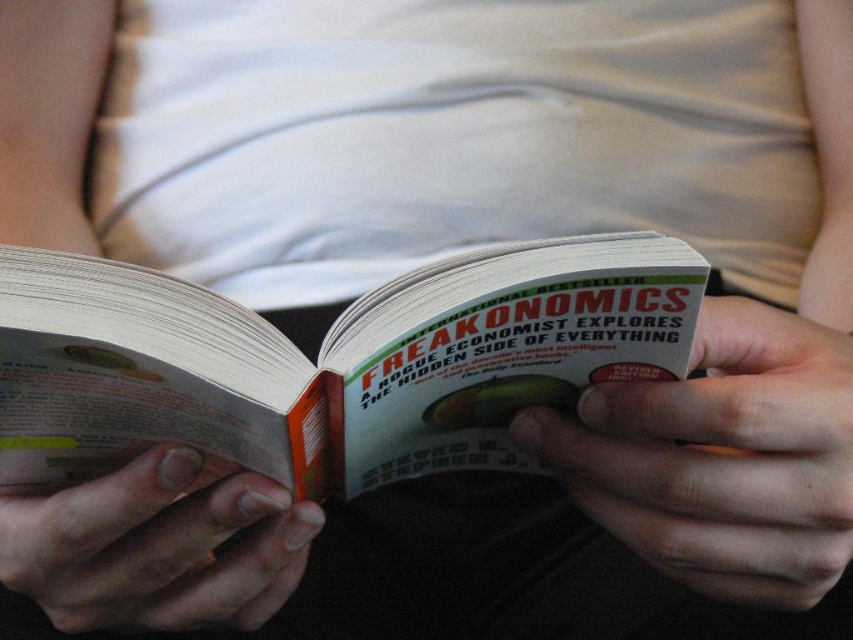
Does smooth skin hand at center appear on the left side of smooth skin hand at lower left?

In fact, smooth skin hand at center is to the right of smooth skin hand at lower left.

Does point (699, 346) lie behind point (9, 538)?

Yes, point (699, 346) is farther from viewer.

Identify the location of smooth skin hand at center. This screenshot has height=640, width=853. (723, 456).

Is white paper book at center above smooth skin hand at center?

Yes.

Is white paper book at center in front of smooth skin hand at center?

Yes, white paper book at center is closer to the viewer.

Which is behind, point (62, 410) or point (614, 509)?

Point (614, 509)

At what (x,y) coordinates should I click in order to perform the action: click on white paper book at center. Please return your answer as a coordinate pair (x, y). The image size is (853, 640). Looking at the image, I should click on (329, 362).

Based on the photo, is white paper book at center shorter than smooth skin hand at lower left?

No.

Which is more to the left, white paper book at center or smooth skin hand at lower left?

smooth skin hand at lower left

The image size is (853, 640). What are the coordinates of `white paper book at center` in the screenshot? It's located at (329, 362).